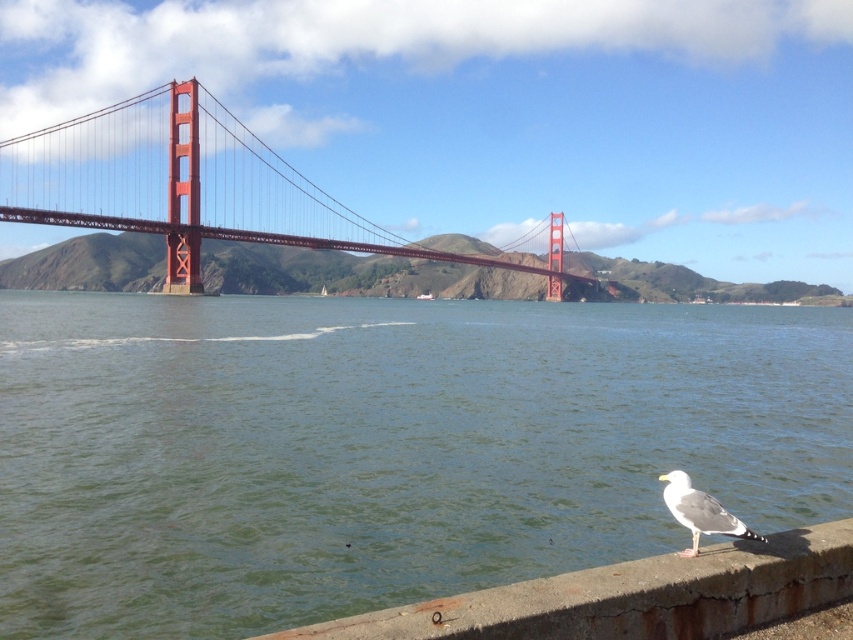
Question: Which object is the farthest from the green water at lower center?

Choices:
 (A) metallic red suspension bridge at upper center
 (B) white feathered seagull at lower right
 (C) concrete at lower right

Answer: (A)

Question: Is green water at lower center smaller than metallic red suspension bridge at upper center?

Choices:
 (A) no
 (B) yes

Answer: (B)

Question: Which point appears closest to the camera in this image?

Choices:
 (A) (686, 480)
 (B) (144, 195)
 (C) (379, 472)

Answer: (A)

Question: Based on their relative distances, which object is farther from the green water at lower center?

Choices:
 (A) white feathered seagull at lower right
 (B) metallic red suspension bridge at upper center

Answer: (B)

Question: Is concrete at lower right in front of white feathered seagull at lower right?

Choices:
 (A) yes
 (B) no

Answer: (A)

Question: Can you confirm if metallic red suspension bridge at upper center is positioned below concrete at lower right?

Choices:
 (A) yes
 (B) no

Answer: (B)